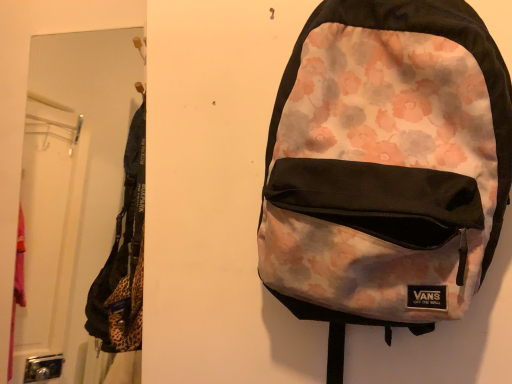
Question: From their relative heights in the image, would you say floral-patterned fabric backpack at center is taller or shorter than metallic silver mirror at left?

Choices:
 (A) short
 (B) tall

Answer: (A)

Question: Looking at their shapes, would you say floral-patterned fabric backpack at center is wider or thinner than metallic silver mirror at left?

Choices:
 (A) wide
 (B) thin

Answer: (B)

Question: Is point (462, 185) positioned closer to the camera than point (50, 165)?

Choices:
 (A) farther
 (B) closer

Answer: (B)

Question: Is point (52, 160) closer or farther from the camera than point (440, 44)?

Choices:
 (A) farther
 (B) closer

Answer: (A)

Question: From the image's perspective, is metallic silver mirror at left positioned above or below floral-patterned fabric backpack at center?

Choices:
 (A) below
 (B) above

Answer: (B)

Question: Considering their positions, is metallic silver mirror at left located in front of or behind floral-patterned fabric backpack at center?

Choices:
 (A) behind
 (B) front

Answer: (A)

Question: Would you say metallic silver mirror at left is inside or outside floral-patterned fabric backpack at center?

Choices:
 (A) inside
 (B) outside

Answer: (B)